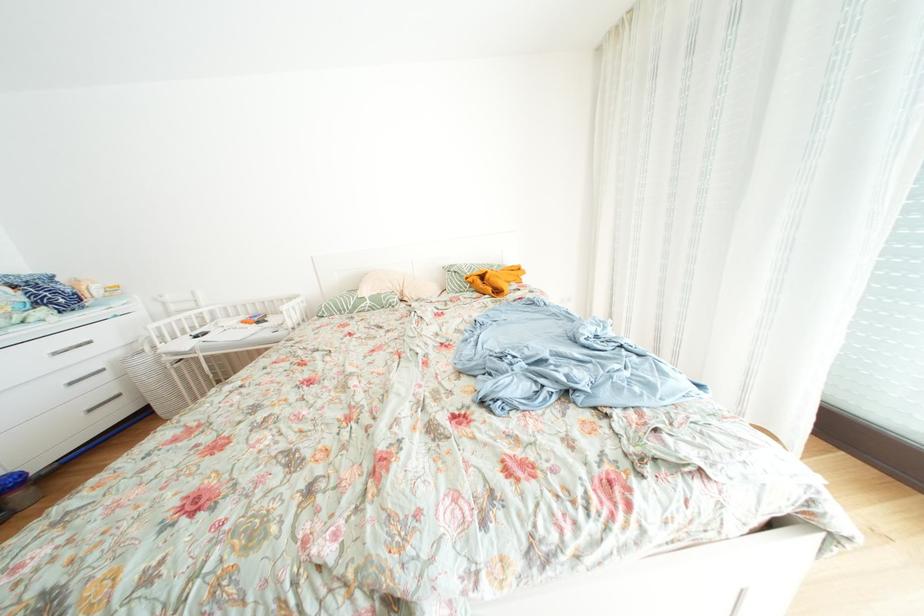
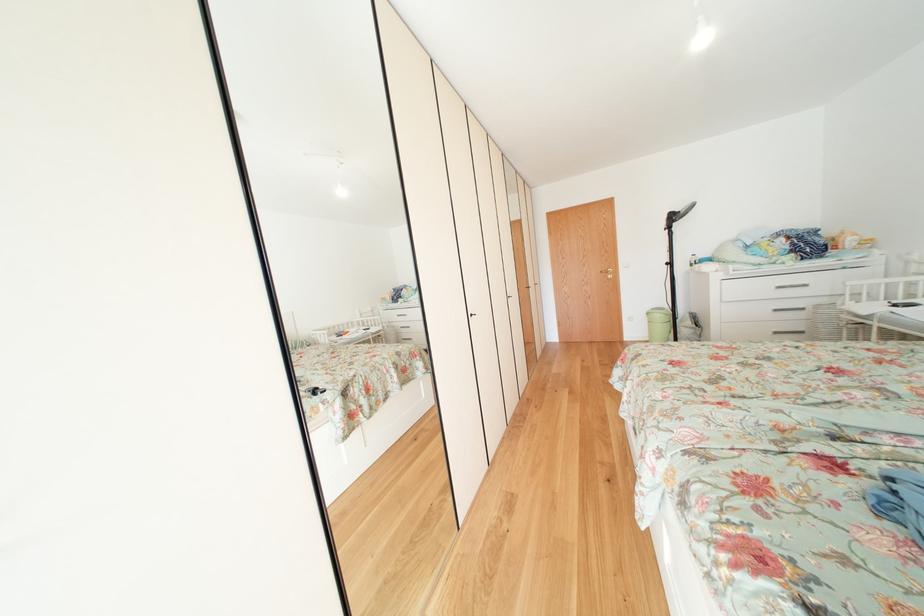
Locate, in the second image, the point that corresponds to (x=66, y=359) in the first image.

(787, 292)